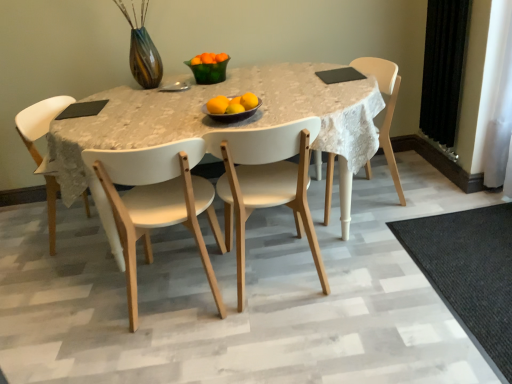
What do you see at coordinates (156, 203) in the screenshot? I see `white matte chair at center, which ranks as the 3th chair in right-to-left order` at bounding box center [156, 203].

Find the location of `black textured mat at lower right`. black textured mat at lower right is located at coordinates (469, 273).

The height and width of the screenshot is (384, 512). Describe the element at coordinates (266, 183) in the screenshot. I see `white matte chair at center, which is the 2th chair in right-to-left order` at that location.

This screenshot has height=384, width=512. In order to click on orange matte at center, the 2th orange viewed from the top in this screenshot , I will do `click(207, 58)`.

Does white matte chair at center, acting as the fourth chair starting from the right, contain white matte chair at center, which ranks as the 3th chair in right-to-left order?

No, white matte chair at center, which ranks as the 3th chair in right-to-left order, is located outside of white matte chair at center, acting as the fourth chair starting from the right.

Who is taller, white matte chair at center, which appears as the first chair when viewed from the left, or white matte chair at center, the second chair in the left-to-right sequence?

white matte chair at center, the second chair in the left-to-right sequence, is taller.

Could you tell me if white matte chair at center, acting as the fourth chair starting from the right, is turned towards white matte chair at center, the second chair in the left-to-right sequence?

No, white matte chair at center, acting as the fourth chair starting from the right, does not turn towards white matte chair at center, the second chair in the left-to-right sequence.

Which is behind, yellow matte/orange at center, which appears as the fourth orange when ordered from the bottom, or white matte table at center?

yellow matte/orange at center, which appears as the fourth orange when ordered from the bottom, is behind.

Which of these two, yellow matte/orange at center, which appears as the third orange when viewed from the top, or white matte table at center, is wider?

white matte table at center is wider.

From the image's perspective, is yellow matte/orange at center, which appears as the third orange when viewed from the top, located beneath white matte table at center?

No, from the image's perspective, yellow matte/orange at center, which appears as the third orange when viewed from the top, is not beneath white matte table at center.

From a real-world perspective, which is physically above, yellow matte/orange at center, which appears as the fourth orange when ordered from the bottom, or white matte table at center?

yellow matte/orange at center, which appears as the fourth orange when ordered from the bottom, is physically above.

Which orange is the 4th one when counting from the front of the orange matte at center, the sixth orange viewed from the front? Please provide its 2D coordinates.

[(234, 108)]

Is orange matte at center, the sixth orange viewed from the front, positioned behind yellow matte/orange at center, which appears as the fifth orange when viewed from the back?

Yes, it is behind yellow matte/orange at center, which appears as the fifth orange when viewed from the back.

Consider the image. What's the angular difference between yellow matte/orange at center, positioned as the fifth orange in top-to-bottom order, and orange matte at center, which appears as the 2th orange when viewed from the back,'s facing directions?

There is a 0.00453-degree angle between the facing directions of yellow matte/orange at center, positioned as the fifth orange in top-to-bottom order, and orange matte at center, which appears as the 2th orange when viewed from the back.

There is a orange matte at center, which is the fifth orange from front to back. Identify the location of the 3rd orange below it (from the image's perspective). (218, 105).

Is yellow matte/orange at center, the sixth orange viewed from the back, wider than orange matte at center, which is the fifth orange from front to back?

Yes, yellow matte/orange at center, the sixth orange viewed from the back, is wider than orange matte at center, which is the fifth orange from front to back.

Are yellow matte/orange at center, the second orange in the bottom-to-top sequence, and orange matte at center, the 2th orange viewed from the top, beside each other?

There is a gap between yellow matte/orange at center, the second orange in the bottom-to-top sequence, and orange matte at center, the 2th orange viewed from the top.

From a real-world perspective, does yellow matte/orange at center, positioned as the fifth orange in top-to-bottom order, sit lower than white matte chair at center, acting as the fourth chair starting from the right?

No.

Is point (213, 102) positioned before point (53, 174)?

That is True.

Is yellow matte/orange at center, the sixth orange viewed from the back, far from white matte chair at center, which appears as the first chair when viewed from the left?

Yes, yellow matte/orange at center, the sixth orange viewed from the back, and white matte chair at center, which appears as the first chair when viewed from the left, are quite far apart.

Which is more to the left, yellow matte/orange at center, positioned as the fifth orange in top-to-bottom order, or white matte chair at center, acting as the fourth chair starting from the right?

white matte chair at center, acting as the fourth chair starting from the right, is more to the left.

What are the coordinates of `chair that is the 1st object located in front of the yellow matte/orange at center, the second orange in the bottom-to-top sequence` in the screenshot? It's located at (266, 183).

From the picture: Does white matte chair at center, placed as the 3th chair when sorted from left to right, have a larger size compared to yellow matte/orange at center, the sixth orange viewed from the back?

Yes.

From a real-world perspective, is white matte chair at center, which is the 2th chair in right-to-left order, positioned under yellow matte/orange at center, positioned as the fifth orange in top-to-bottom order, based on gravity?

Yes, from a real-world perspective, white matte chair at center, which is the 2th chair in right-to-left order, is below yellow matte/orange at center, positioned as the fifth orange in top-to-bottom order.

Which point is more forward, (258,162) or (226,104)?

Positioned in front is point (226,104).

From the picture: Considering the positions of objects white matte table at center and white wood chair at center, which ranks as the first chair in right-to-left order, in the image provided, who is more to the right, white matte table at center or white wood chair at center, which ranks as the first chair in right-to-left order,?

white wood chair at center, which ranks as the first chair in right-to-left order, is more to the right.

Is white matte table at center behind white wood chair at center, which is the 4th chair from left to right?

No, the depth of white matte table at center is less than that of white wood chair at center, which is the 4th chair from left to right.

From the image's perspective, which one is positioned lower, white matte table at center or white wood chair at center, which ranks as the first chair in right-to-left order?

white matte table at center.

Between white matte table at center and white wood chair at center, which ranks as the first chair in right-to-left order, which one has more height?

With more height is white matte table at center.

Image resolution: width=512 pixels, height=384 pixels. What are the coordinates of `the 3rd chair above the white matte chair at center, the second chair in the left-to-right sequence (from a real-world perspective)` in the screenshot? It's located at (37, 150).

The height and width of the screenshot is (384, 512). What are the coordinates of `kitchen & dining room table that appears below the yellow matte/orange at center, which is counted as the 4th orange, starting from the front (from a real-world perspective)` in the screenshot? It's located at (220, 125).

From the image, which object appears to be farther from yellow matte/orange at center, which is the third orange from front to back, black textured mat at lower right or white matte chair at center, which is the 2th chair in right-to-left order?

black textured mat at lower right lies further to yellow matte/orange at center, which is the third orange from front to back, than the other object.

Estimate the real-world distances between objects in this image. Which object is closer to black velvet curtain at right, yellow matte/orange at center, which appears as the fourth orange when ordered from the bottom, or yellow matte/orange at center, which is the 4th orange from top to bottom?

The object closer to black velvet curtain at right is yellow matte/orange at center, which is the 4th orange from top to bottom.

Estimate the real-world distances between objects in this image. Which object is further from white wood chair at center, which ranks as the first chair in right-to-left order, white matte chair at center, the second chair in the left-to-right sequence, or white matte table at center?

A: white matte chair at center, the second chair in the left-to-right sequence, is further to white wood chair at center, which ranks as the first chair in right-to-left order.

Which object lies further to the anchor point black velvet curtain at right, white matte chair at center, which ranks as the 3th chair in right-to-left order, or yellow matte/orange at center, the 1th orange positioned from the bottom?

white matte chair at center, which ranks as the 3th chair in right-to-left order, is positioned further to the anchor black velvet curtain at right.

Estimate the real-world distances between objects in this image. Which object is further from yellow matte/orange at center, which appears as the fifth orange when viewed from the back, white matte chair at center, which ranks as the 3th chair in right-to-left order, or white matte chair at center, which is the 2th chair in right-to-left order?

white matte chair at center, which ranks as the 3th chair in right-to-left order, is positioned further to the anchor yellow matte/orange at center, which appears as the fifth orange when viewed from the back.

Considering their positions, is white matte table at center positioned further to white matte chair at center, which is the 2th chair in right-to-left order, than orange matte at center, which is the fifth orange from front to back?

Among the two, orange matte at center, which is the fifth orange from front to back, is located further to white matte chair at center, which is the 2th chair in right-to-left order.

Considering their positions, is white matte table at center positioned closer to yellow matte/orange at center, the 1th orange positioned from the bottom, than black velvet curtain at right?

white matte table at center is closer to yellow matte/orange at center, the 1th orange positioned from the bottom.

From the image, which object appears to be farther from orange matte at center, which is the fifth orange from bottom to top, white matte table at center or yellow matte/orange at center, the sixth orange viewed from the back?

Based on the image, yellow matte/orange at center, the sixth orange viewed from the back, appears to be further to orange matte at center, which is the fifth orange from bottom to top.

Find the location of a particular element. The height and width of the screenshot is (384, 512). orange that lies between yellow matte/orange at center, positioned as the fifth orange in top-to-bottom order, and white matte chair at center, which ranks as the 3th chair in right-to-left order, from top to bottom is located at coordinates (234, 108).

Locate an element on the screen. kitchen & dining room table between white matte chair at center, the second chair in the left-to-right sequence, and white matte chair at center, placed as the 3th chair when sorted from left to right, in the horizontal direction is located at coordinates (220, 125).

Where is `kitchen & dining room table between yellow matte/orange at center, which is the 1th orange in front-to-back order, and white matte chair at center, which is the 2th chair in right-to-left order, in the up-down direction`? This screenshot has width=512, height=384. kitchen & dining room table between yellow matte/orange at center, which is the 1th orange in front-to-back order, and white matte chair at center, which is the 2th chair in right-to-left order, in the up-down direction is located at coordinates (220, 125).

Identify the location of orange located between yellow matte/orange at center, acting as the 2th orange starting from the front, and yellow matte/orange at center, the third orange from the back, in the depth direction. The width and height of the screenshot is (512, 384). (249, 101).